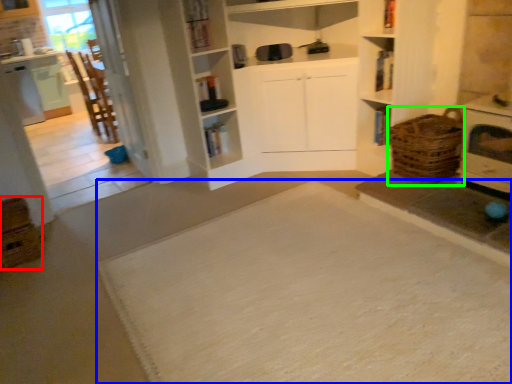
Question: Which object is positioned closest to crate (highlighted by a red box)? Select from doormat (highlighted by a blue box) and basket (highlighted by a green box).

Choices:
 (A) doormat
 (B) basket

Answer: (A)